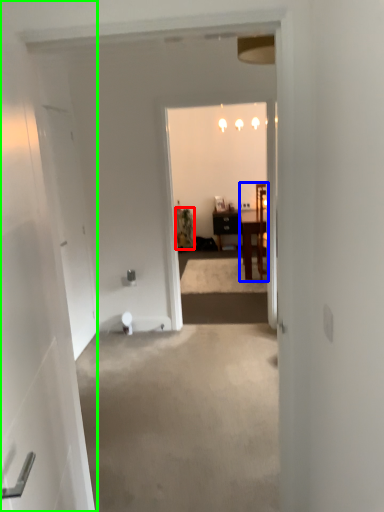
Question: Considering the real-world distances, which object is closest to houseplant (highlighted by a red box)? chair (highlighted by a blue box) or door (highlighted by a green box).

Choices:
 (A) chair
 (B) door

Answer: (A)